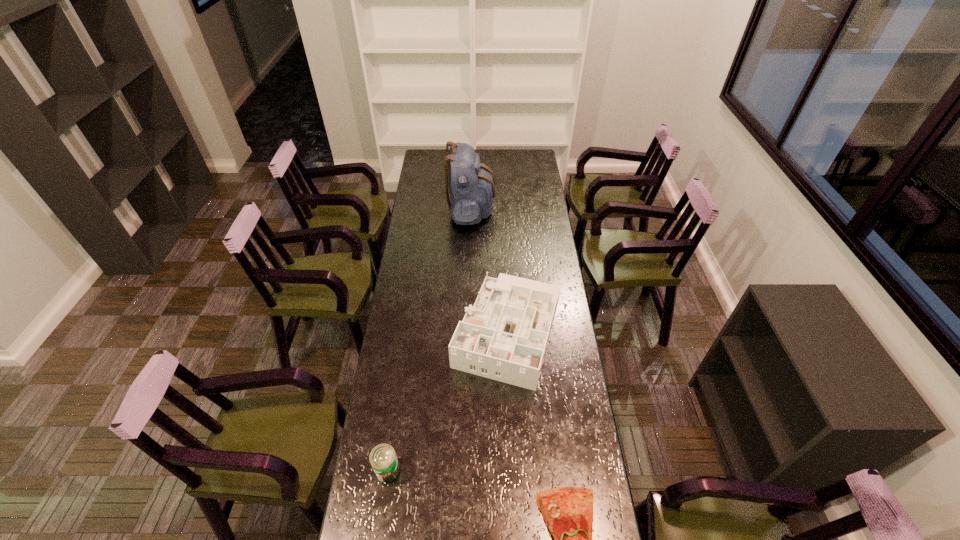
This screenshot has width=960, height=540. Find the location of `object positioned at the right edge`. object positioned at the right edge is located at coordinates (504, 336).

Image resolution: width=960 pixels, height=540 pixels. In the image, there is a desktop. Identify the location of free region at the left edge. (427, 174).

Find the location of a particular element. Image resolution: width=960 pixels, height=540 pixels. vacant space at the right edge of the desktop is located at coordinates (521, 195).

What are the coordinates of `blank space at the far right corner of the desktop` in the screenshot? It's located at (533, 163).

This screenshot has width=960, height=540. What are the coordinates of `free space between the farthest object and the second nearest object` in the screenshot? It's located at (429, 339).

At what (x,y) coordinates should I click in order to perform the action: click on empty location between the backpack and the third shortest object. Please return your answer as a coordinate pair (x, y). The width and height of the screenshot is (960, 540). Looking at the image, I should click on (490, 269).

The width and height of the screenshot is (960, 540). Find the location of `free area in between the third tallest object and the backpack`. free area in between the third tallest object and the backpack is located at coordinates (429, 339).

Locate which object ranks second in proximity to the can. Please provide its 2D coordinates. Your answer should be formatted as a tuple, i.e. [(x, y)], where the tuple contains the x and y coordinates of a point satisfying the conditions above.

[(567, 511)]

The height and width of the screenshot is (540, 960). Find the location of `object that is the nearest to the farthest object`. object that is the nearest to the farthest object is located at coordinates (504, 336).

At what (x,y) coordinates should I click in order to perform the action: click on free spot that satisfies the following two spatial constraints: 1. at the front pocket of the farthest object; 2. on the right side of the third nearest object. Please return your answer as a coordinate pair (x, y). This screenshot has height=540, width=960. Looking at the image, I should click on (468, 330).